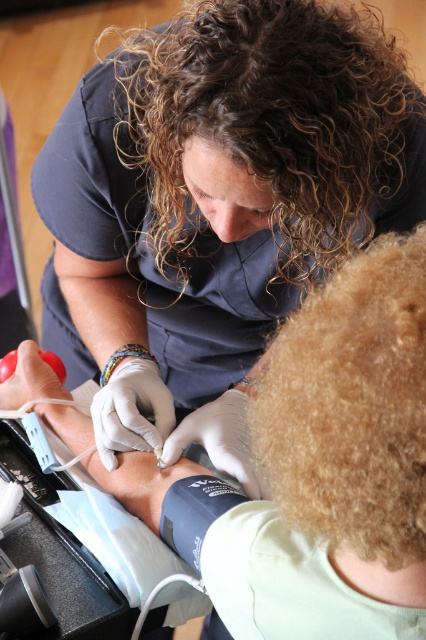
You are a nurse trying to locate two specific points on the image. The first point is at coordinate point (265, 97) and the second is at coordinate point (265, 440). From the perspective of someone facing the image, which point is closer to the left side of the image?

Point (265, 97) is closer to the left side of the image compared to point (265, 440).

You are a patient in the room and want to see the healthcare provider. Which hair do you need to look towards first, the curly brown hair at upper center or the curly golden hair at lower right?

You need to look towards the curly brown hair at upper center first because it is closer to you than the curly golden hair at lower right.

You are a medical student observing a blood draw procedure. The camera is positioned to capture the healthcare professional inserting a needle into the patient. There is a point labeled as point (314, 38) in the image. If you want to get a closer look at this point, should you move forward or backward?

The point (314, 38) is 32.74 inches away from the camera. To get closer to it, you should move forward towards the point.